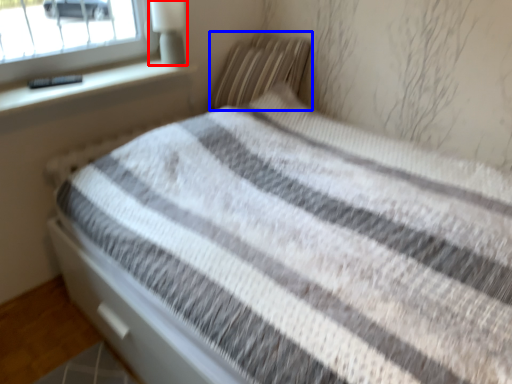
Question: Which of the following is the farthest to the observer, lamp (highlighted by a red box) or pillow (highlighted by a blue box)?

Choices:
 (A) lamp
 (B) pillow

Answer: (B)